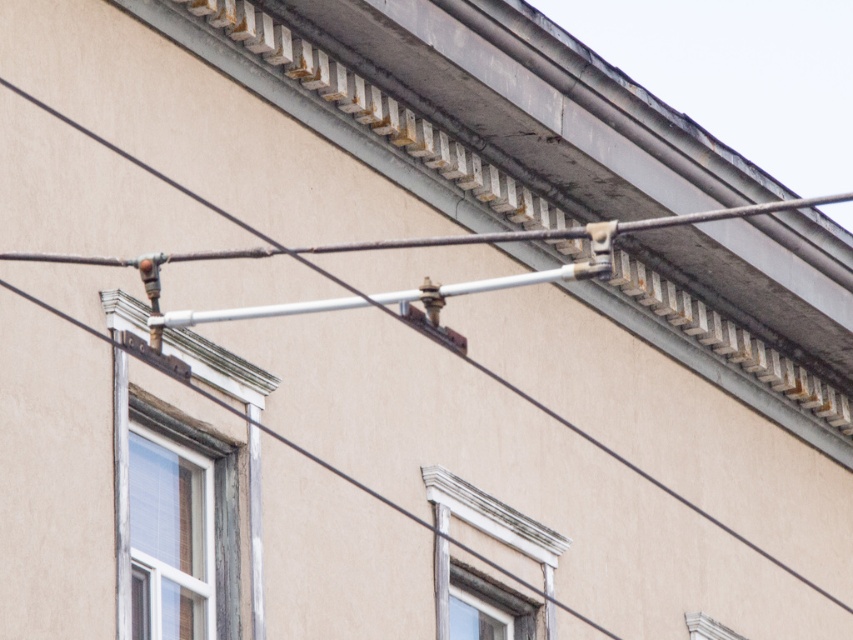
Question: Which object is closer to the camera taking this photo?

Choices:
 (A) wooden window frame at lower center
 (B) white painted wood window at center

Answer: (B)

Question: Is the position of wooden window at left more distant than that of white painted wood window at center?

Choices:
 (A) yes
 (B) no

Answer: (B)

Question: Which point is closer to the camera taking this photo?

Choices:
 (A) (509, 595)
 (B) (438, 548)
 (C) (221, 452)

Answer: (C)

Question: Which object is positioned closest to the white painted wood window at center?

Choices:
 (A) wooden window frame at lower center
 (B) wooden window at left

Answer: (A)

Question: Can you confirm if wooden window at left is positioned below wooden window frame at lower center?

Choices:
 (A) yes
 (B) no

Answer: (B)

Question: Can you confirm if white painted wood window at center is positioned below wooden window frame at lower center?

Choices:
 (A) yes
 (B) no

Answer: (B)